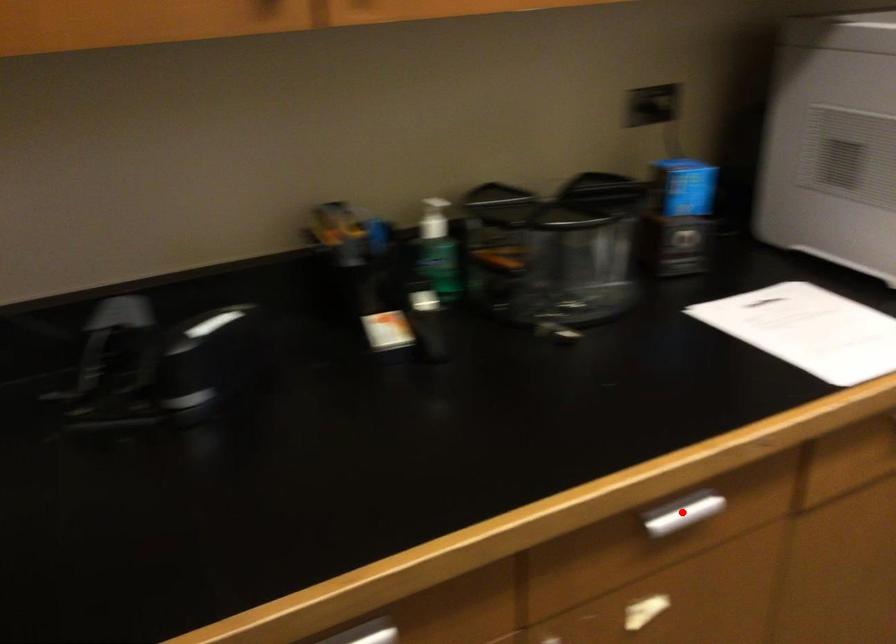
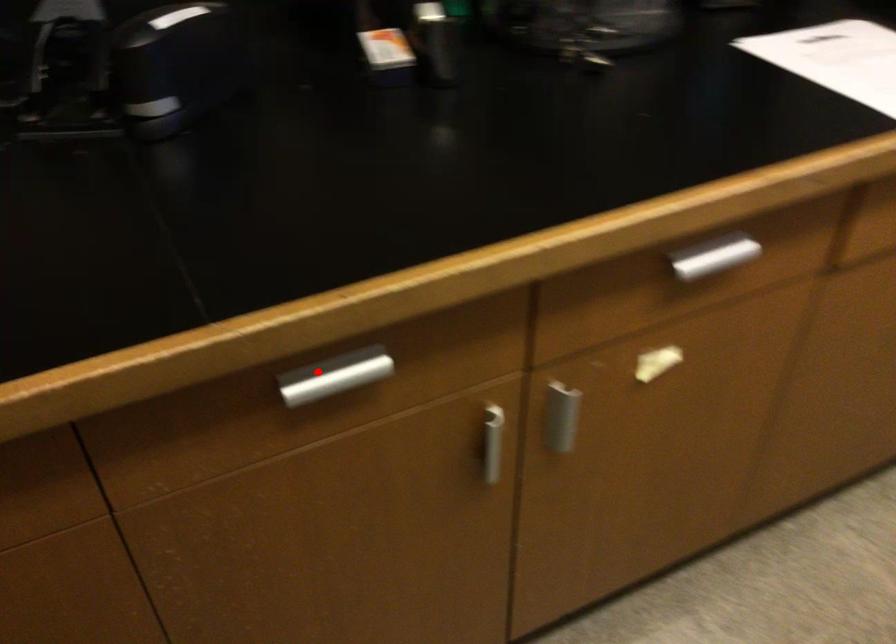
I am providing you with two images of the same scene from different viewpoints. A red point is marked on the first image and another point is marked on the second image. Is the red point in image1 aligned with the point shown in image2?

No